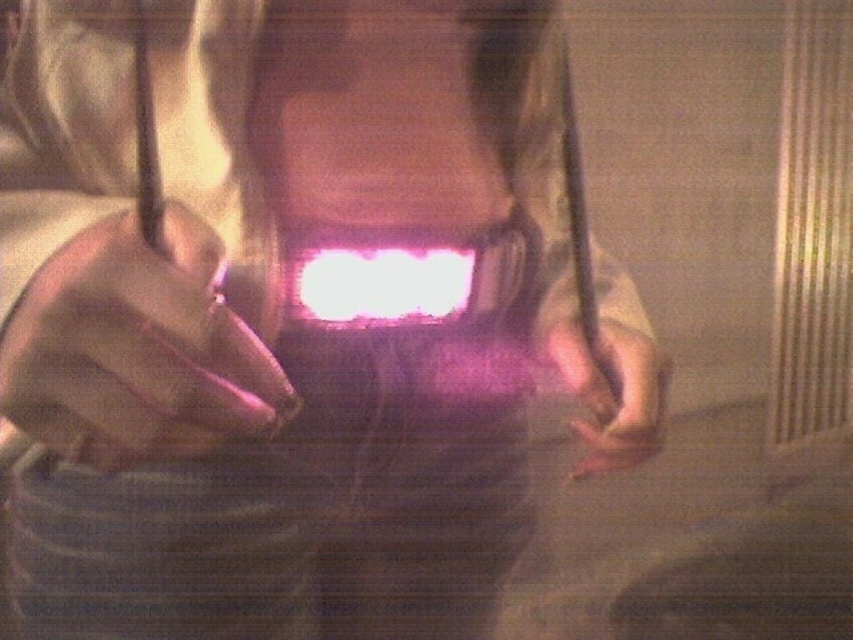
Can you confirm if bright white light at center is positioned below pink matte hand at lower right?

No, bright white light at center is not below pink matte hand at lower right.

Can you confirm if bright white light at center is smaller than pink matte hand at lower right?

Yes.

Image resolution: width=853 pixels, height=640 pixels. In order to click on bright white light at center in this screenshot , I will do `click(380, 284)`.

You are a GUI agent. You are given a task and a screenshot of the screen. Output one action in this format:
    pyautogui.click(x=<x>, y=<y>)
    Task: Click on the bright white light at center
    The height and width of the screenshot is (640, 853).
    Given the screenshot: What is the action you would take?
    pyautogui.click(x=380, y=284)

Does matte purple glove at center have a lesser width compared to bright white light at center?

Yes.

Who is more distant from viewer, [59,444] or [415,250]?

Point [415,250]

The height and width of the screenshot is (640, 853). I want to click on matte purple glove at center, so 135,349.

Is point (190, 380) closer to viewer compared to point (613, 426)?

Yes, point (190, 380) is closer to viewer.

Between matte purple glove at center and pink matte hand at lower right, which one appears on the left side from the viewer's perspective?

matte purple glove at center is more to the left.

At what (x,y) coordinates should I click in order to perform the action: click on matte purple glove at center. Please return your answer as a coordinate pair (x, y). This screenshot has height=640, width=853. Looking at the image, I should click on (135, 349).

Identify the location of matte purple glove at center. The height and width of the screenshot is (640, 853). (135, 349).